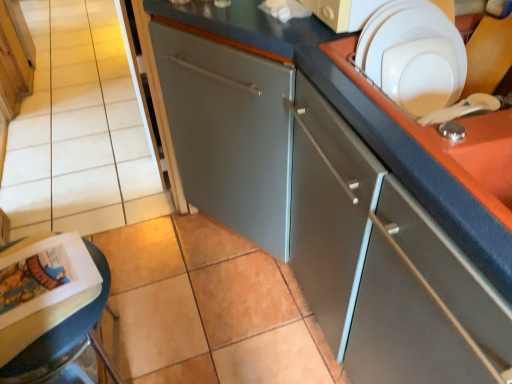
Image resolution: width=512 pixels, height=384 pixels. Describe the element at coordinates (336, 196) in the screenshot. I see `satin gray cabinet at center, the second cabinetry from the back` at that location.

The image size is (512, 384). What do you see at coordinates (413, 56) in the screenshot? I see `white glossy plate at upper right` at bounding box center [413, 56].

Locate an element on the screen. This screenshot has width=512, height=384. satin gray cabinet at center, which is counted as the 1th cabinetry, starting from the bottom is located at coordinates (336, 196).

Is white glossy plate at upper right beside satin gray cabinet at center, the 2th cabinetry positioned from the top?

No, white glossy plate at upper right is not in contact with satin gray cabinet at center, the 2th cabinetry positioned from the top.

How different are the orientations of white glossy plate at upper right and satin gray cabinet at center, arranged as the 1th cabinetry when viewed from the front, in degrees?

84 degrees separate the facing orientations of white glossy plate at upper right and satin gray cabinet at center, arranged as the 1th cabinetry when viewed from the front.

Do you think white glossy plate at upper right is within satin gray cabinet at center, which is the 1th cabinetry in right-to-left order, or outside of it?

white glossy plate at upper right is not inside satin gray cabinet at center, which is the 1th cabinetry in right-to-left order, it's outside.

From a real-world perspective, is white glossy plate at upper right physically located above or below satin gray cabinet at center, the second cabinetry from the back?

Clearly, from a real-world perspective, white glossy plate at upper right is above satin gray cabinet at center, the second cabinetry from the back.

Is point (460, 36) positioned behind point (12, 9)?

No, (460, 36) is in front of (12, 9).

Which is correct: white glossy plate at upper right is inside matte wood cabinet at upper left, the first cabinetry viewed from the left, or outside of it?

white glossy plate at upper right is spatially situated outside matte wood cabinet at upper left, the first cabinetry viewed from the left.

From a real-world perspective, is white glossy plate at upper right over matte wood cabinet at upper left, placed as the second cabinetry when sorted from bottom to top?

Yes, from a real-world perspective, white glossy plate at upper right is over matte wood cabinet at upper left, placed as the second cabinetry when sorted from bottom to top

How different are the orientations of white glossy plate at upper right and matte wood cabinet at upper left, the first cabinetry viewed from the left, in degrees?

98.7 degrees.

Which point is more distant from viewer, [338,317] or [1,358]?

The point [338,317] is more distant.

Is matte paper magazine at lower left at the back of satin gray cabinet at center, the 2th cabinetry when ordered from left to right?

satin gray cabinet at center, the 2th cabinetry when ordered from left to right, does not have its back to matte paper magazine at lower left.

How different are the orientations of satin gray cabinet at center, the 2th cabinetry positioned from the top, and matte paper magazine at lower left in degrees?

151 degrees.

Based on the photo, can you see white glossy plate at upper right touching white glossy sink at upper right?

There is a gap between white glossy plate at upper right and white glossy sink at upper right.

Based on their positions, is white glossy plate at upper right located to the left or right of white glossy sink at upper right?

white glossy plate at upper right is to the left of white glossy sink at upper right.

Is white glossy plate at upper right surrounding white glossy sink at upper right?

Actually, white glossy sink at upper right is outside white glossy plate at upper right.

Is white glossy sink at upper right at the back of white glossy plate at upper right?

Yes, white glossy sink at upper right is at the back of white glossy plate at upper right.

Consider the image. Considering the positions of objects white glossy plate at upper right and matte paper magazine at lower left in the image provided, who is more to the right, white glossy plate at upper right or matte paper magazine at lower left?

Positioned to the right is white glossy plate at upper right.

From the image's perspective, is white glossy plate at upper right located above or below matte paper magazine at lower left?

white glossy plate at upper right is above matte paper magazine at lower left.

From a real-world perspective, which is physically above, white glossy plate at upper right or matte paper magazine at lower left?

From a 3D spatial view, white glossy plate at upper right is above.

How many degrees apart are the facing directions of matte paper magazine at lower left and white glossy plate at upper right?

The angle between the facing direction of matte paper magazine at lower left and the facing direction of white glossy plate at upper right is 125 degrees.

From the image's perspective, which one is positioned higher, matte paper magazine at lower left or white glossy plate at upper right?

white glossy plate at upper right, from the image's perspective.

Is matte paper magazine at lower left in contact with white glossy plate at upper right?

There is a gap between matte paper magazine at lower left and white glossy plate at upper right.

Considering the relative positions of matte wood cabinet at upper left, the 1th cabinetry viewed from the top, and white glossy sink at upper right in the image provided, is matte wood cabinet at upper left, the 1th cabinetry viewed from the top, to the right of white glossy sink at upper right from the viewer's perspective?

In fact, matte wood cabinet at upper left, the 1th cabinetry viewed from the top, is to the left of white glossy sink at upper right.

Which object is closer to the camera taking this photo, matte wood cabinet at upper left, the 1th cabinetry viewed from the top, or white glossy sink at upper right?

white glossy sink at upper right.

Is matte wood cabinet at upper left, the 1th cabinetry viewed from the top, wider or thinner than white glossy sink at upper right?

matte wood cabinet at upper left, the 1th cabinetry viewed from the top, is thinner than white glossy sink at upper right.

Between matte wood cabinet at upper left, the first cabinetry viewed from the left, and white glossy sink at upper right, which one has less height?

white glossy sink at upper right is shorter.

Starting from the white glossy plate at upper right, which cabinetry is the 1st one behind? Please provide its 2D coordinates.

[(336, 196)]

The height and width of the screenshot is (384, 512). What are the coordinates of `cabinetry above the white glossy plate at upper right (from the image's perspective)` in the screenshot? It's located at (14, 58).

In the scene shown: Which object lies nearer to the anchor point matte paper magazine at lower left, matte wood cabinet at upper left, the first cabinetry from the back, or white glossy sink at upper right?

Based on the image, white glossy sink at upper right appears to be nearer to matte paper magazine at lower left.

Based on their spatial positions, is matte wood cabinet at upper left, marked as the 2th cabinetry in a front-to-back arrangement, or satin gray cabinet at center, the 2th cabinetry positioned from the top, further from matte paper magazine at lower left?

Among the two, matte wood cabinet at upper left, marked as the 2th cabinetry in a front-to-back arrangement, is located further to matte paper magazine at lower left.

Looking at this image, estimate the real-world distances between objects in this image. Which object is closer to white glossy sink at upper right, white glossy plate at upper right or satin gray cabinet at center, which is counted as the 1th cabinetry, starting from the bottom?

white glossy plate at upper right is closer to white glossy sink at upper right.

Looking at the image, which one is located further to matte wood cabinet at upper left, the first cabinetry from the back, satin gray cabinet at center, the 2th cabinetry when ordered from left to right, or matte paper magazine at lower left?

Based on the image, satin gray cabinet at center, the 2th cabinetry when ordered from left to right, appears to be further to matte wood cabinet at upper left, the first cabinetry from the back.

When comparing their distances from white glossy sink at upper right, does white glossy plate at upper right or matte paper magazine at lower left seem closer?

white glossy plate at upper right is closer to white glossy sink at upper right.

When comparing their distances from matte wood cabinet at upper left, the first cabinetry viewed from the left, does white glossy plate at upper right or matte paper magazine at lower left seem further?

Among the two, white glossy plate at upper right is located further to matte wood cabinet at upper left, the first cabinetry viewed from the left.

Estimate the real-world distances between objects in this image. Which object is closer to matte paper magazine at lower left, satin gray cabinet at center, arranged as the 1th cabinetry when viewed from the front, or white glossy plate at upper right?

Among the two, satin gray cabinet at center, arranged as the 1th cabinetry when viewed from the front, is located nearer to matte paper magazine at lower left.

Which object lies further to the anchor point white glossy plate at upper right, matte paper magazine at lower left or satin gray cabinet at center, which is the 1th cabinetry in right-to-left order?

matte paper magazine at lower left lies further to white glossy plate at upper right than the other object.

Identify the location of tableware between white glossy sink at upper right and satin gray cabinet at center, which is counted as the 1th cabinetry, starting from the bottom, from front to back. (413, 56).

This screenshot has height=384, width=512. Identify the location of cabinetry between matte paper magazine at lower left and white glossy sink at upper right from left to right. (336, 196).

The width and height of the screenshot is (512, 384). Find the location of `tableware between matte paper magazine at lower left and white glossy sink at upper right in the horizontal direction`. tableware between matte paper magazine at lower left and white glossy sink at upper right in the horizontal direction is located at coordinates (413, 56).

Identify the location of cabinetry located between matte wood cabinet at upper left, acting as the 2th cabinetry starting from the right, and white glossy plate at upper right in the left-right direction. This screenshot has height=384, width=512. 336,196.